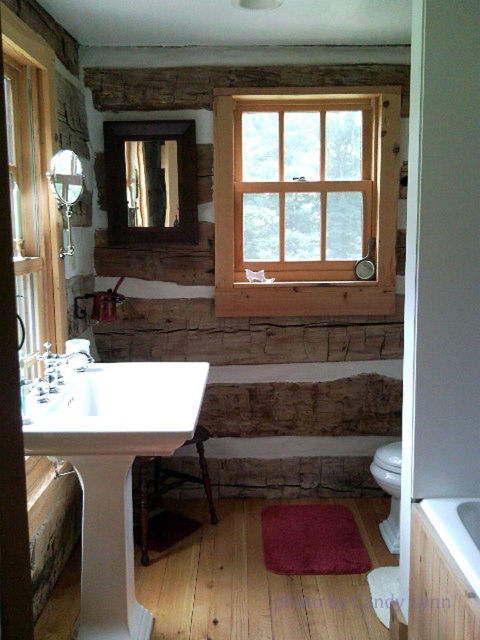
Does wooden frame at center appear on the left side of white glossy bathtub at lower right?

Correct, you'll find wooden frame at center to the left of white glossy bathtub at lower right.

Which is more to the right, wooden frame at center or white glossy bathtub at lower right?

Positioned to the right is white glossy bathtub at lower right.

Is point (267, 102) more distant than point (471, 506)?

That is True.

In order to click on wooden frame at center in this screenshot , I will do `click(305, 200)`.

Is wooden frame at center taller than white glossy sink at center?

Indeed, wooden frame at center has a greater height compared to white glossy sink at center.

Is point (332, 108) positioned after point (188, 378)?

Yes, it is.

Identify the location of wooden frame at center. The image size is (480, 640). (305, 200).

Can you confirm if white glossy sink at center is smaller than white glossy bathtub at lower right?

No.

Can you confirm if white glossy sink at center is thinner than white glossy bathtub at lower right?

Incorrect, white glossy sink at center's width is not less than white glossy bathtub at lower right's.

At what (x,y) coordinates should I click in order to perform the action: click on white glossy sink at center. Please return your answer as a coordinate pair (x, y). The height and width of the screenshot is (640, 480). Looking at the image, I should click on (119, 410).

Find the location of a particular element. white glossy sink at center is located at coordinates (119, 410).